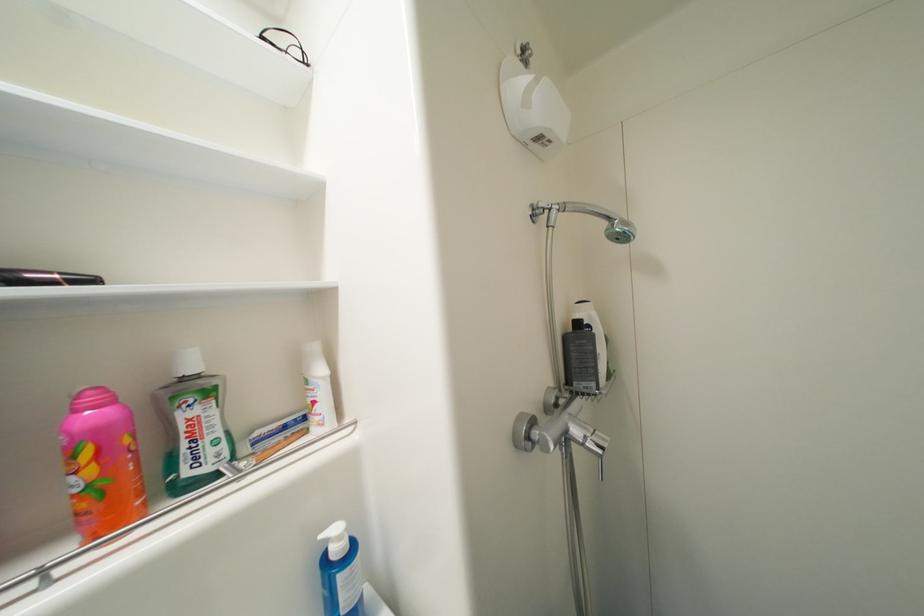
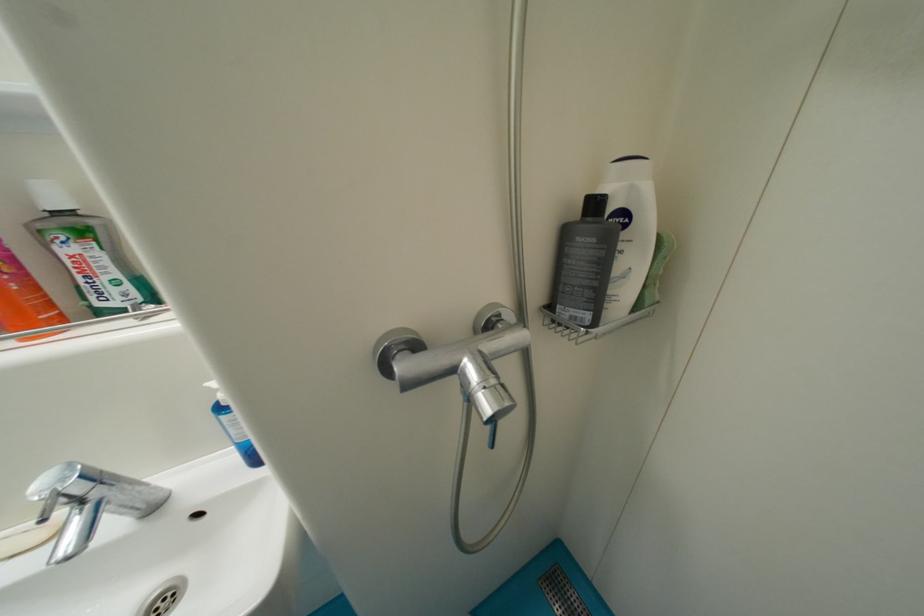
First-person continuous shooting, in which direction is the camera rotating?

The camera rotated toward left-down.